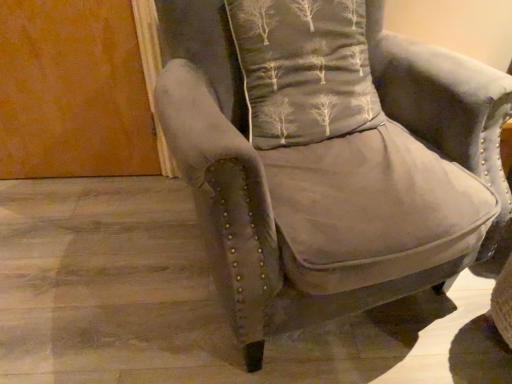
Question: Which direction should I rotate to look at dark gray fabric pillow with tree pattern at upper center?

Choices:
 (A) left
 (B) right

Answer: (B)

Question: Is dark gray fabric pillow with tree pattern at upper center next to suede-like gray armchair at center and touching it?

Choices:
 (A) yes
 (B) no

Answer: (B)

Question: From a real-world perspective, is dark gray fabric pillow with tree pattern at upper center physically above suede-like gray armchair at center?

Choices:
 (A) yes
 (B) no

Answer: (A)

Question: From the image's perspective, is dark gray fabric pillow with tree pattern at upper center on top of suede-like gray armchair at center?

Choices:
 (A) yes
 (B) no

Answer: (A)

Question: Does dark gray fabric pillow with tree pattern at upper center have a smaller size compared to suede-like gray armchair at center?

Choices:
 (A) yes
 (B) no

Answer: (A)

Question: Is dark gray fabric pillow with tree pattern at upper center positioned beyond the bounds of suede-like gray armchair at center?

Choices:
 (A) no
 (B) yes

Answer: (A)

Question: Is dark gray fabric pillow with tree pattern at upper center behind suede-like gray armchair at center?

Choices:
 (A) no
 (B) yes

Answer: (B)

Question: From the image's perspective, is suede-like gray armchair at center beneath dark gray fabric pillow with tree pattern at upper center?

Choices:
 (A) yes
 (B) no

Answer: (A)

Question: Is suede-like gray armchair at center aimed at dark gray fabric pillow with tree pattern at upper center?

Choices:
 (A) yes
 (B) no

Answer: (A)

Question: Does suede-like gray armchair at center have a larger size compared to dark gray fabric pillow with tree pattern at upper center?

Choices:
 (A) no
 (B) yes

Answer: (B)

Question: Is suede-like gray armchair at center closer to the viewer compared to dark gray fabric pillow with tree pattern at upper center?

Choices:
 (A) no
 (B) yes

Answer: (B)

Question: Does suede-like gray armchair at center appear on the right side of dark gray fabric pillow with tree pattern at upper center?

Choices:
 (A) no
 (B) yes

Answer: (B)

Question: Is suede-like gray armchair at center further to the viewer compared to dark gray fabric pillow with tree pattern at upper center?

Choices:
 (A) no
 (B) yes

Answer: (A)

Question: From the image's perspective, is dark gray fabric pillow with tree pattern at upper center above or below suede-like gray armchair at center?

Choices:
 (A) above
 (B) below

Answer: (A)